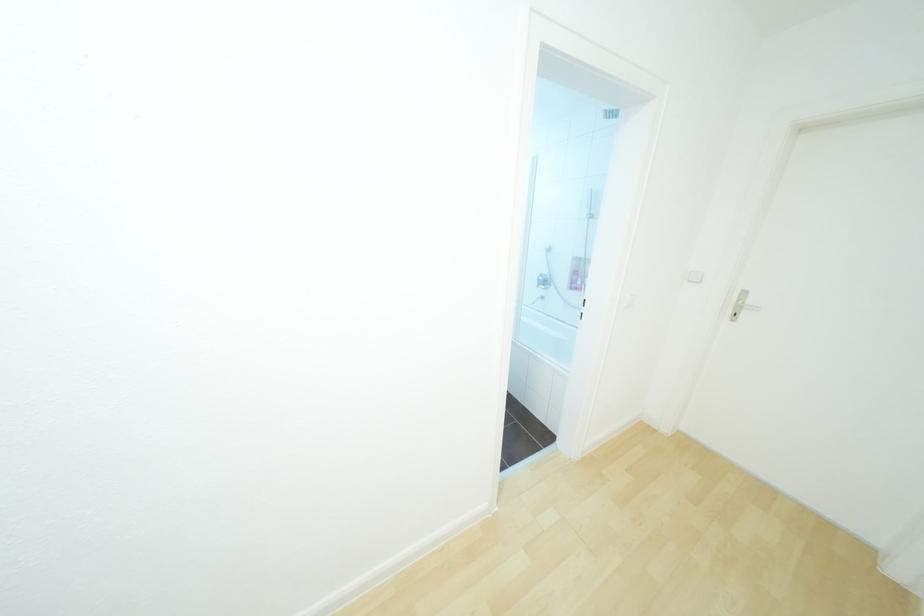
Image resolution: width=924 pixels, height=616 pixels. Find the location of `white light switch`. white light switch is located at coordinates (695, 276).